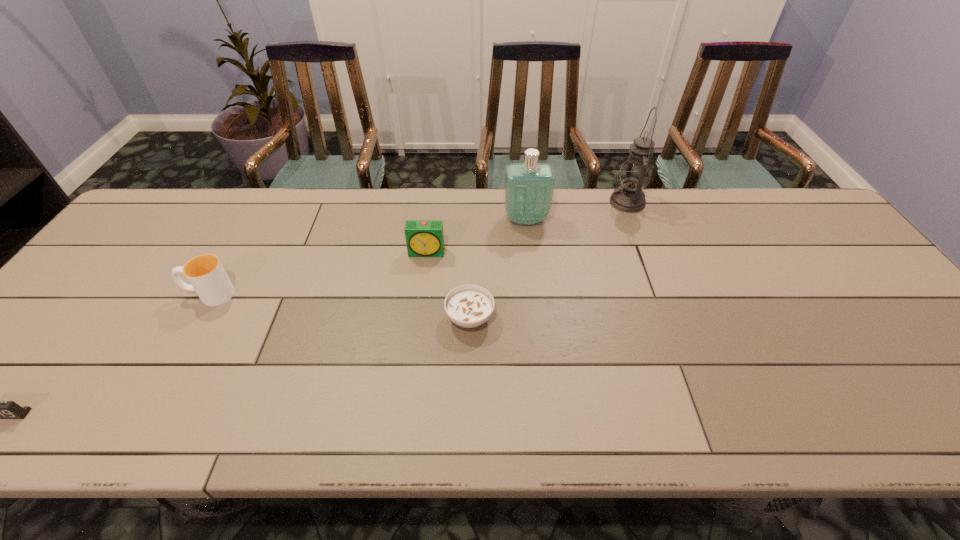
This screenshot has width=960, height=540. I want to click on vacant space located with the handle on the side of the cup, so click(81, 294).

Find the location of a particular element. free space located with the handle on the side of the cup is located at coordinates (124, 294).

Where is `vacant region located 0.180m with the handle on the side of the cup`? This screenshot has width=960, height=540. vacant region located 0.180m with the handle on the side of the cup is located at coordinates (116, 294).

Find the location of a particular element. The image size is (960, 540). blank space located 0.200m on the front-facing side of the third object from left to right is located at coordinates (420, 314).

Find the location of a particular element. This screenshot has width=960, height=540. free space located on the right of the soup bowl is located at coordinates (518, 318).

Find the location of a particular element. The image size is (960, 540). oil lamp that is at the far edge is located at coordinates (635, 173).

You are a GUI agent. You are given a task and a screenshot of the screen. Output one action in this format:
    pyautogui.click(x=<x>, y=<y>)
    Task: Click on the perfume located at the far edge
    The width and height of the screenshot is (960, 540).
    Given the screenshot: What is the action you would take?
    pyautogui.click(x=528, y=192)

This screenshot has height=540, width=960. I want to click on blank space at the far edge, so click(647, 194).

In the image, there is a desktop. Where is `vacant space at the left edge`? Image resolution: width=960 pixels, height=540 pixels. vacant space at the left edge is located at coordinates (65, 358).

In the image, there is a desktop. At what (x,y) coordinates should I click in order to perform the action: click on free space at the right edge. Please return your answer as a coordinate pair (x, y). Looking at the image, I should click on (841, 283).